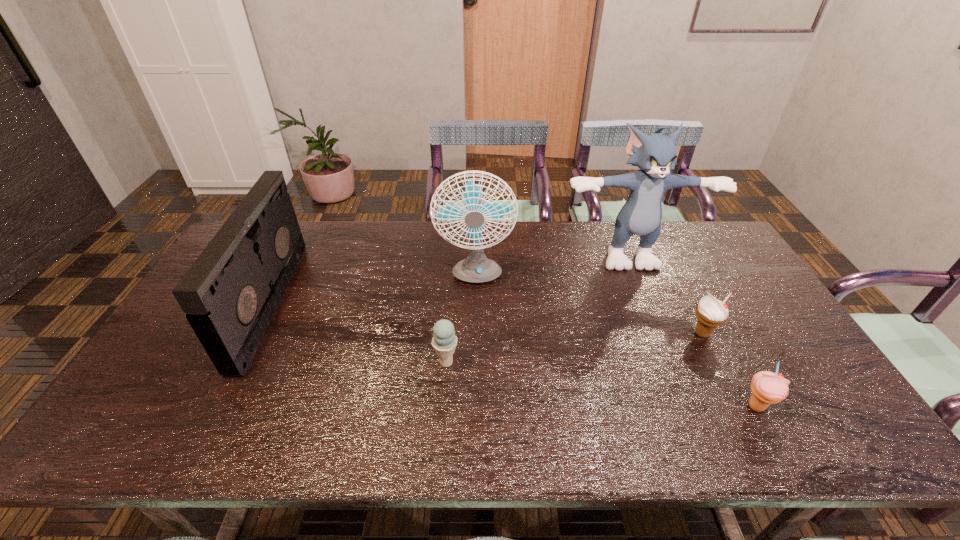
The height and width of the screenshot is (540, 960). Identify the location of vacant space that satisfies the following two spatial constraints: 1. on the front-facing side of the farthest icecream; 2. on the right side of the fan. (474, 334).

This screenshot has width=960, height=540. Identify the location of free space that satisfies the following two spatial constraints: 1. on the front side of the nearest icecream; 2. on the left side of the farthest icecream. (739, 407).